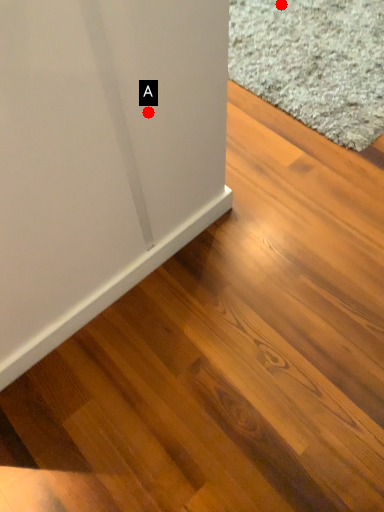
Question: Two points are circled on the image, labeled by A and B beside each circle. Which point is farther from the camera taking this photo?

Choices:
 (A) A is further
 (B) B is further

Answer: (B)